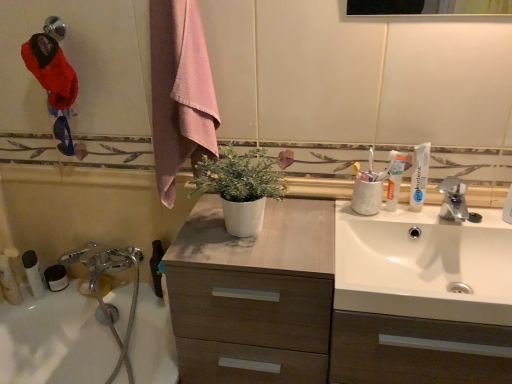
Question: Is white matte pot at center closer to the viewer compared to white plastic tube at lower left, the second toiletry viewed from the right?

Choices:
 (A) no
 (B) yes

Answer: (B)

Question: Is white matte pot at center in contact with white plastic tube at lower left, arranged as the 2th toiletry when viewed from the left?

Choices:
 (A) no
 (B) yes

Answer: (A)

Question: From the image's perspective, is white matte pot at center located above white plastic tube at lower left, the second toiletry viewed from the right?

Choices:
 (A) no
 (B) yes

Answer: (B)

Question: Is there a large distance between white matte pot at center and white plastic tube at lower left, the second toiletry viewed from the right?

Choices:
 (A) no
 (B) yes

Answer: (A)

Question: Is white matte pot at center smaller than white plastic tube at lower left, the second toiletry viewed from the right?

Choices:
 (A) no
 (B) yes

Answer: (A)

Question: Visually, is white matte toothpaste at upper right, the second toothpaste viewed from the right, positioned to the left or to the right of pink cotton towel at upper center?

Choices:
 (A) right
 (B) left

Answer: (A)

Question: Relative to pink cotton towel at upper center, is white matte toothpaste at upper right, the second toothpaste viewed from the left, in front or behind?

Choices:
 (A) behind
 (B) front

Answer: (A)

Question: From the image's perspective, is white matte toothpaste at upper right, the second toothpaste viewed from the right, above or below pink cotton towel at upper center?

Choices:
 (A) below
 (B) above

Answer: (A)

Question: From a real-world perspective, is white matte toothpaste at upper right, the second toothpaste viewed from the right, physically located above or below pink cotton towel at upper center?

Choices:
 (A) below
 (B) above

Answer: (A)

Question: From a real-world perspective, is white plastic tube at left, the 3th toiletry viewed from the left, above or below white matte pot at center?

Choices:
 (A) below
 (B) above

Answer: (A)

Question: Looking at the image, does white plastic tube at left, placed as the first toiletry when sorted from right to left, seem bigger or smaller compared to white matte pot at center?

Choices:
 (A) big
 (B) small

Answer: (B)

Question: Considering the positions of point (30, 266) and point (224, 155), is point (30, 266) closer or farther from the camera than point (224, 155)?

Choices:
 (A) farther
 (B) closer

Answer: (A)

Question: Based on their positions, is white plastic tube at left, placed as the first toiletry when sorted from right to left, located to the left or right of white matte pot at center?

Choices:
 (A) left
 (B) right

Answer: (A)

Question: Is white plastic tube at lower left, the second toiletry viewed from the right, taller or shorter than silver metallic faucet at upper right?

Choices:
 (A) tall
 (B) short

Answer: (A)

Question: Is white plastic tube at lower left, the second toiletry viewed from the right, situated inside silver metallic faucet at upper right or outside?

Choices:
 (A) inside
 (B) outside

Answer: (B)